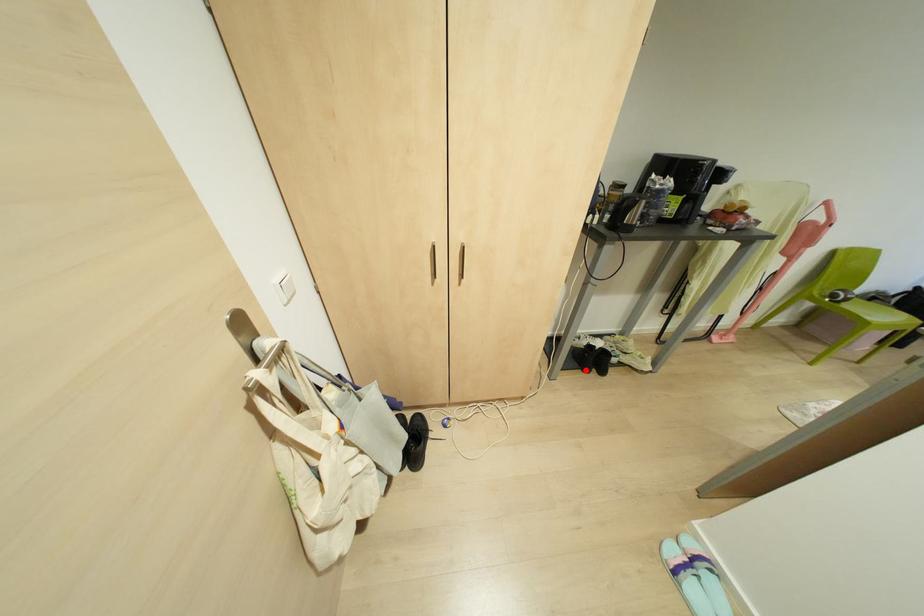
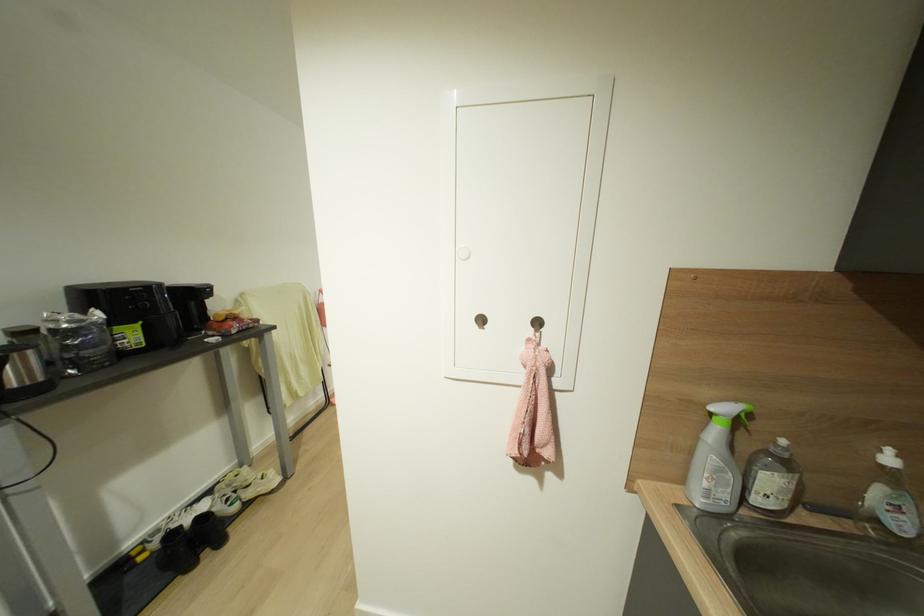
In the second image, find the point that corresponds to the highlighted location in the first image.

(189, 565)